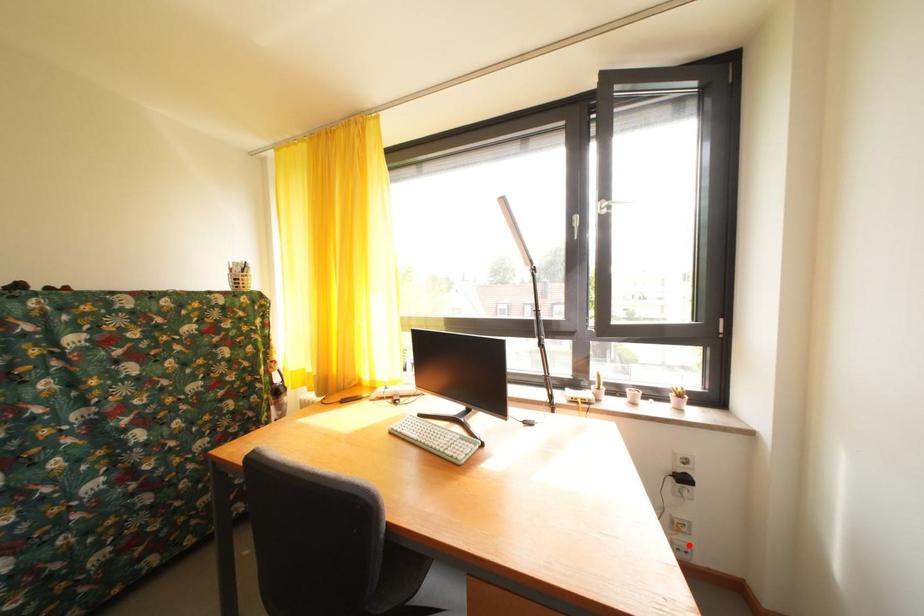
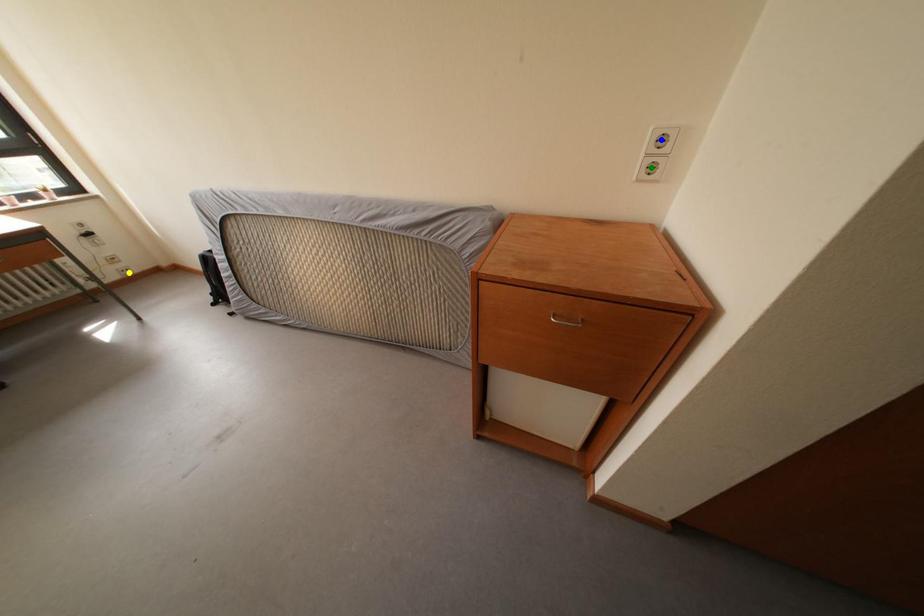
Question: I am providing you with two images of the same scene from different viewpoints. A red point is marked on the first image. You are given multiple points on the second image. Can you choose the point in image 2 that corresponds to the point in image 1?

Choices:
 (A) green point
 (B) yellow point
 (C) blue point

Answer: (B)